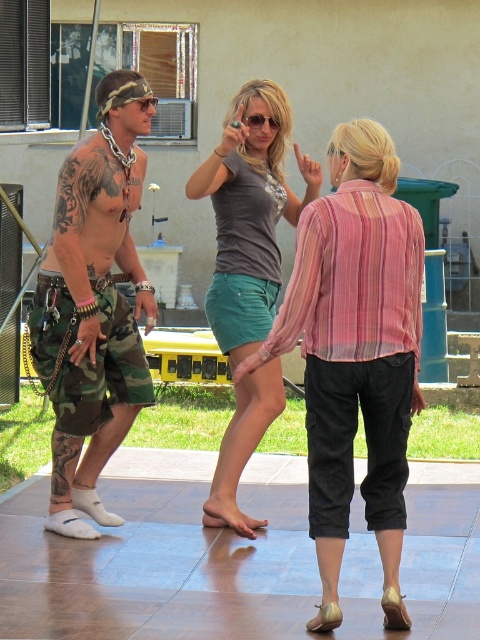
Question: Can you confirm if matte black shorts at center is thinner than matte gray shirt at center?

Choices:
 (A) no
 (B) yes

Answer: (A)

Question: Which point is farther to the camera?

Choices:
 (A) matte gray shirt at center
 (B) matte black shorts at center

Answer: (A)

Question: In this image, where is matte black shorts at center located relative to matte gray shirt at center?

Choices:
 (A) left
 (B) right

Answer: (B)

Question: Which point appears farthest from the camera in this image?

Choices:
 (A) (278, 90)
 (B) (375, 256)
 (C) (126, 387)

Answer: (A)

Question: Does matte black shorts at center appear on the right side of camo shorts at left?

Choices:
 (A) yes
 (B) no

Answer: (A)

Question: Which of the following is the farthest from the observer?

Choices:
 (A) (315, 387)
 (B) (107, 355)

Answer: (B)